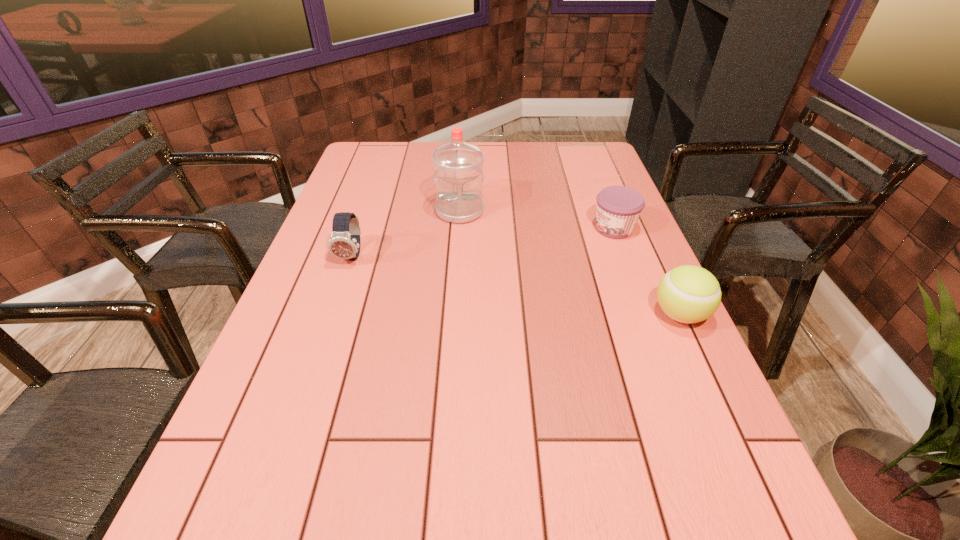
This screenshot has width=960, height=540. I want to click on empty location between the shortest object and the nearest object, so click(647, 272).

Identify the location of free space that is in between the nearest object and the third farthest object. (516, 285).

The width and height of the screenshot is (960, 540). Find the location of `free space between the jam and the nearest object`. free space between the jam and the nearest object is located at coordinates (647, 272).

The width and height of the screenshot is (960, 540). I want to click on object that can be found as the second closest to the jam, so click(x=458, y=176).

Where is `object identified as the third closest to the water bottle`? Image resolution: width=960 pixels, height=540 pixels. object identified as the third closest to the water bottle is located at coordinates pos(689,294).

Where is `vacant space that satisfies the following two spatial constraints: 1. on the front side of the tallest object; 2. on the right side of the tennis ball`? The image size is (960, 540). vacant space that satisfies the following two spatial constraints: 1. on the front side of the tallest object; 2. on the right side of the tennis ball is located at coordinates (453, 314).

Where is `free space that satisfies the following two spatial constraints: 1. on the face of the nearest object; 2. on the right side of the second nearest object`? This screenshot has width=960, height=540. free space that satisfies the following two spatial constraints: 1. on the face of the nearest object; 2. on the right side of the second nearest object is located at coordinates (332, 314).